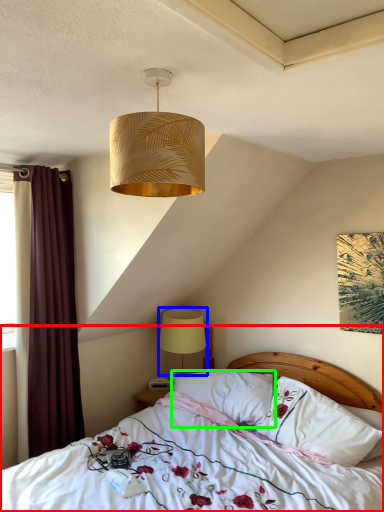
Question: Considering the real-world distances, which object is farthest from bed (highlighted by a red box)? lamp (highlighted by a blue box) or pillow (highlighted by a green box)?

Choices:
 (A) lamp
 (B) pillow

Answer: (A)